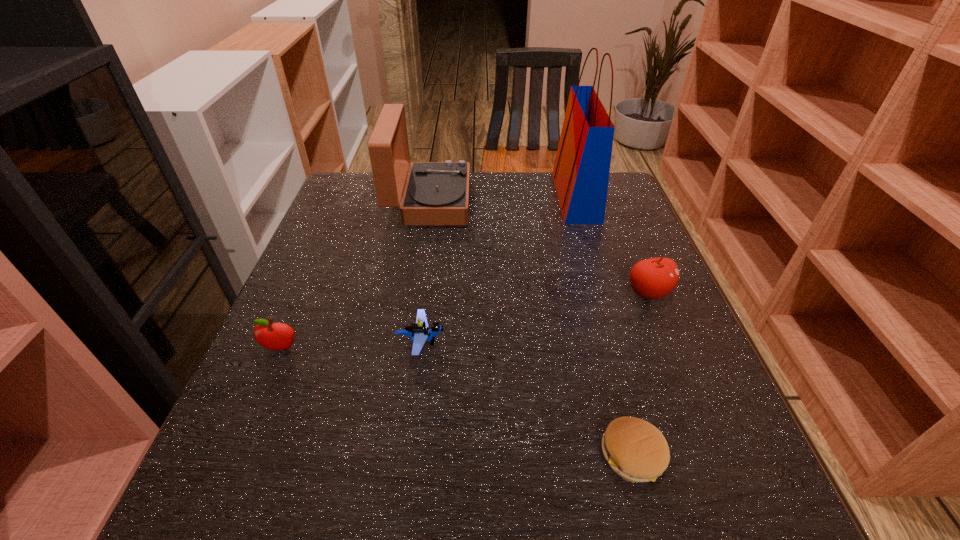
You are a GUI agent. You are given a task and a screenshot of the screen. Output one action in this format:
    pyautogui.click(x=<x>, y=<y>)
    Task: Click on the vacant point located on the handle side of the shopping bag
    The width and height of the screenshot is (960, 540).
    Given the screenshot: What is the action you would take?
    pyautogui.click(x=514, y=197)

Where is `free space located 0.200m on the handle side of the shopping bag`? Image resolution: width=960 pixels, height=540 pixels. free space located 0.200m on the handle side of the shopping bag is located at coordinates (485, 197).

Locate an element on the screen. The height and width of the screenshot is (540, 960). vacant region located on the face of the fifth shortest object is located at coordinates (540, 202).

You are a GUI agent. You are given a task and a screenshot of the screen. Output one action in this format:
    pyautogui.click(x=<x>, y=<y>)
    Task: Click on the free space located on the back of the right apple
    The width and height of the screenshot is (960, 540).
    Given the screenshot: What is the action you would take?
    pyautogui.click(x=609, y=195)

Image resolution: width=960 pixels, height=540 pixels. I want to click on free space located on the right of the left apple, so click(x=480, y=349).

Locate an element on the screen. The image size is (960, 540). blank space located on the front-facing side of the fifth tallest object is located at coordinates (502, 342).

Identify the location of free spot located 0.390m on the back of the nearest object. The width and height of the screenshot is (960, 540). (583, 269).

Find the location of a particular element. The image size is (960, 540). shopping bag present at the far edge is located at coordinates (581, 171).

I want to click on phonograph record that is positioned at the far edge, so click(x=436, y=193).

The width and height of the screenshot is (960, 540). I want to click on object that is at the near edge, so click(636, 450).